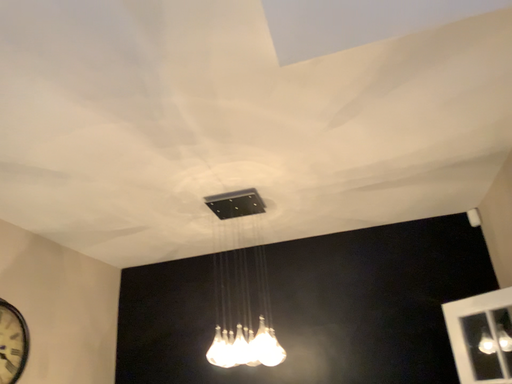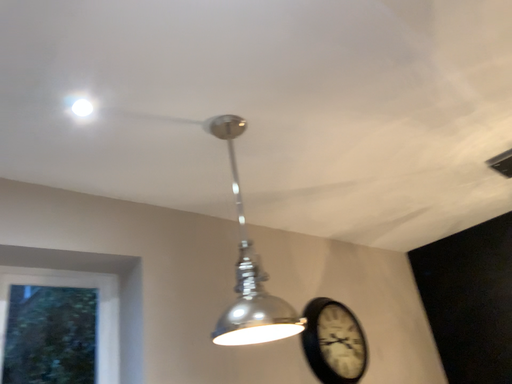
Question: How did the camera likely rotate when shooting the video?

Choices:
 (A) rotated right
 (B) rotated left

Answer: (B)